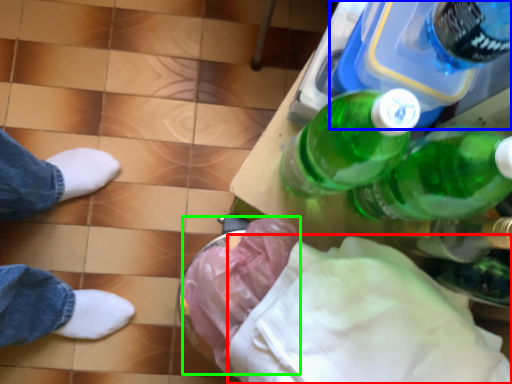
Question: Based on their relative distances, which object is farther from cloth (highlighted by a red box)? Choose from bottle (highlighted by a blue box) and material (highlighted by a green box).

Choices:
 (A) bottle
 (B) material

Answer: (A)